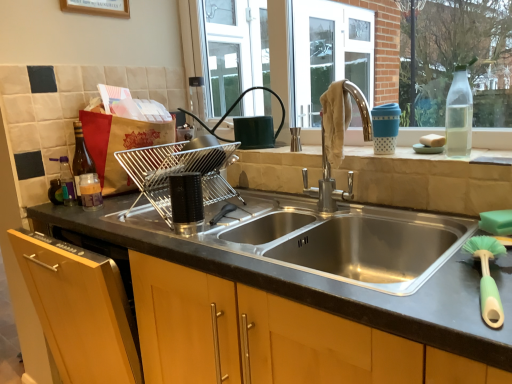
Where is `free space between translucent plastic bottle at left, which is the third bottle from back to front, and black plastic dish rack at center, marked as the second appliance in a back-to-front arrangement`? free space between translucent plastic bottle at left, which is the third bottle from back to front, and black plastic dish rack at center, marked as the second appliance in a back-to-front arrangement is located at coordinates (136, 218).